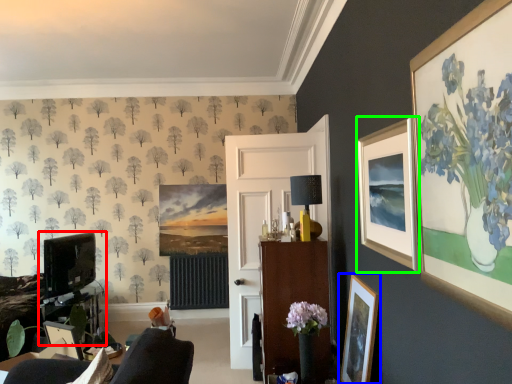
Question: Which is nearer to the entertainment center (highlighted by a red box)? picture frame (highlighted by a blue box) or picture frame (highlighted by a green box).

Choices:
 (A) picture frame
 (B) picture frame

Answer: (A)